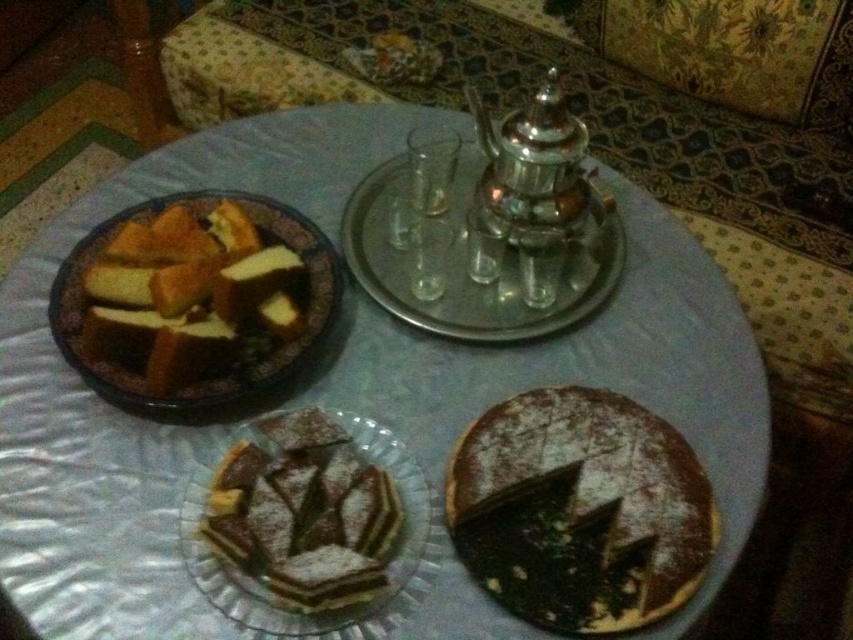
What is located at the coordinates point (579, 509)?

The powdered chocolate cake at lower right is located at point (579, 509).

You are a guest at a dinner party and want to reach for the powdered chocolate cake at lower right without knocking over the metallic silver tray at upper center. Which item should you move first?

The powdered chocolate cake at lower right is shorter than the metallic silver tray at upper center, so you should move the metallic silver tray at upper center first to avoid knocking it over when reaching for the cake.